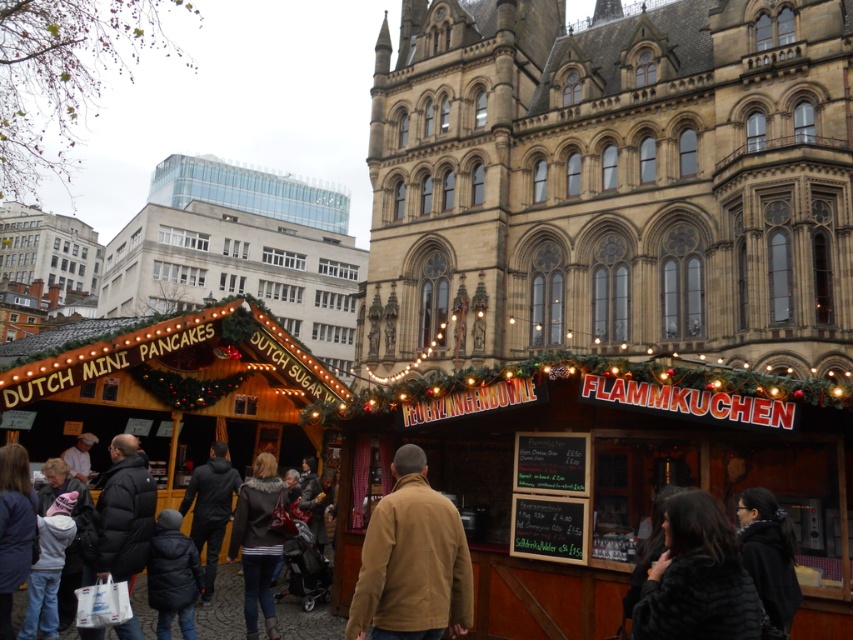
Who is higher up, black fur coat at lower right or dark brown leather jacket at lower center?

black fur coat at lower right is above.

Who is positioned more to the right, black fur coat at lower right or dark brown leather jacket at lower center?

black fur coat at lower right

Based on the photo, who is more distant from viewer, (747, 604) or (294, 600)?

The point (294, 600) is behind.

Where is `black fur coat at lower right`? This screenshot has width=853, height=640. black fur coat at lower right is located at coordinates (697, 579).

Is point (361, 577) less distant than point (300, 612)?

Yes, point (361, 577) is closer to viewer.

What do you see at coordinates (412, 561) in the screenshot? This screenshot has height=640, width=853. I see `tan softshell jacket at center` at bounding box center [412, 561].

Between point (407, 634) and point (260, 630), which one is positioned behind?

The point (260, 630) is more distant.

Where is `tan softshell jacket at center`? The image size is (853, 640). tan softshell jacket at center is located at coordinates (412, 561).

Does tan softshell jacket at center have a greater width compared to black fur coat at lower right?

Yes.

Which is in front, point (448, 557) or point (700, 532)?

Point (700, 532) is more forward.

This screenshot has width=853, height=640. Identify the location of tan softshell jacket at center. (412, 561).